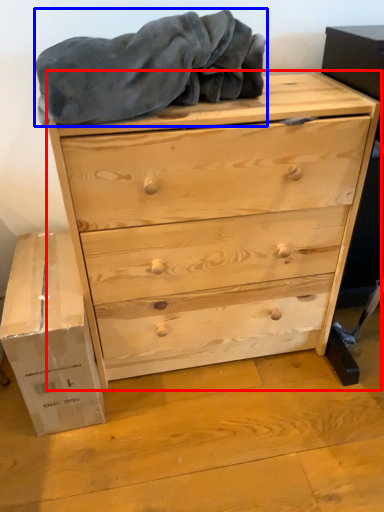
Question: Which object appears farthest to the camera in this image, chest of drawers (highlighted by a red box) or blanket (highlighted by a blue box)?

Choices:
 (A) chest of drawers
 (B) blanket

Answer: (A)